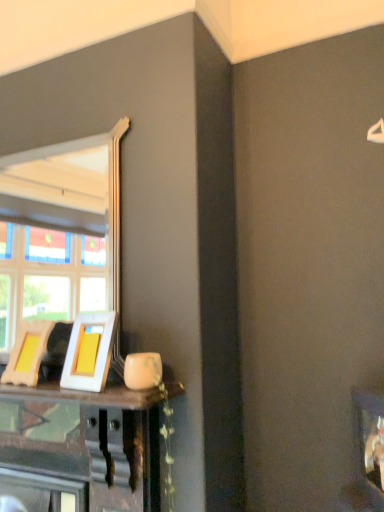
Question: In terms of height, does white glossy picture frame at center, the second picture frame viewed from the left, look taller or shorter compared to wooden picture frame at lower left, the 1th picture frame from the left?

Choices:
 (A) short
 (B) tall

Answer: (B)

Question: Is white glossy picture frame at center, the 1th picture frame from the right, in front of or behind wooden picture frame at lower left, the 1th picture frame from the left, in the image?

Choices:
 (A) front
 (B) behind

Answer: (A)

Question: From a real-world perspective, is white glossy picture frame at center, the 1th picture frame from the right, positioned above or below wooden picture frame at lower left, the 1th picture frame from the left?

Choices:
 (A) above
 (B) below

Answer: (A)

Question: Based on their sizes in the image, would you say wooden picture frame at lower left, the 1th picture frame from the left, is bigger or smaller than white glossy picture frame at center, the second picture frame viewed from the left?

Choices:
 (A) big
 (B) small

Answer: (B)

Question: Choose the correct answer: Is wooden picture frame at lower left, the 1th picture frame from the left, inside white glossy picture frame at center, the second picture frame viewed from the left, or outside it?

Choices:
 (A) outside
 (B) inside

Answer: (A)

Question: From their relative heights in the image, would you say wooden picture frame at lower left, the 1th picture frame from the left, is taller or shorter than white glossy picture frame at center, the 1th picture frame from the right?

Choices:
 (A) tall
 (B) short

Answer: (B)

Question: From a real-world perspective, is wooden picture frame at lower left, the 1th picture frame from the left, physically located above or below white glossy picture frame at center, the second picture frame viewed from the left?

Choices:
 (A) above
 (B) below

Answer: (B)